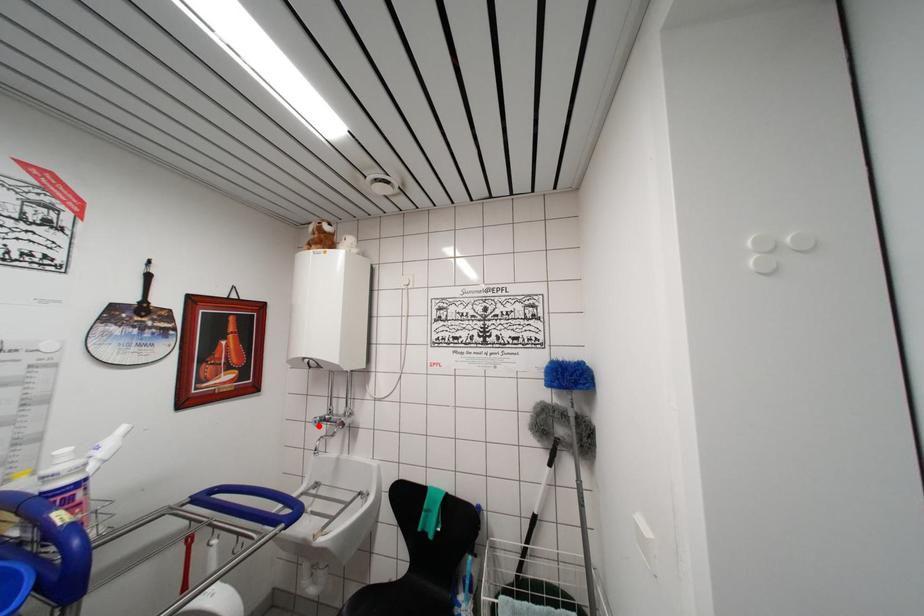
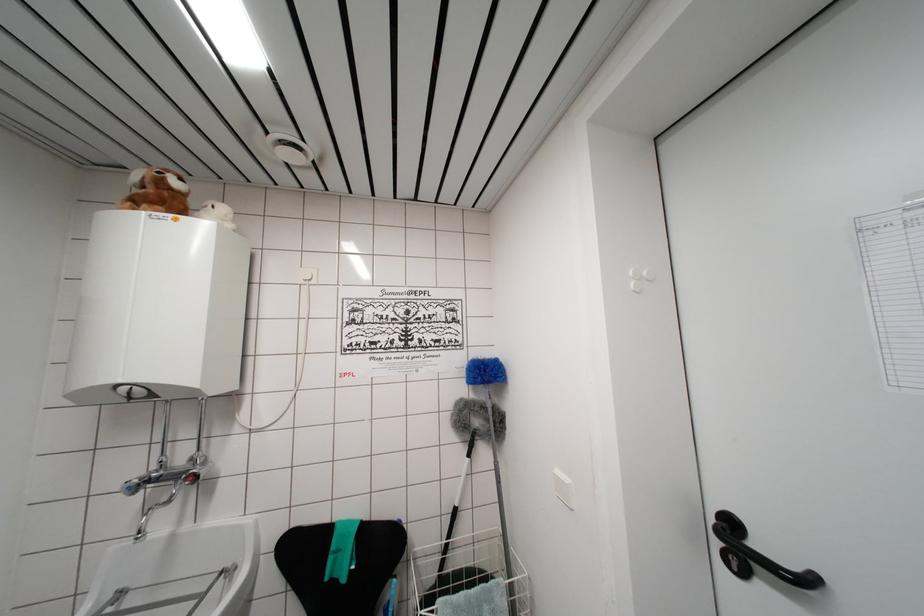
Question: I am providing you with two images of the same scene from different viewpoints. A red point is marked on the first image. Is the red point's position out of view in image 2?

Choices:
 (A) Yes
 (B) No

Answer: (B)